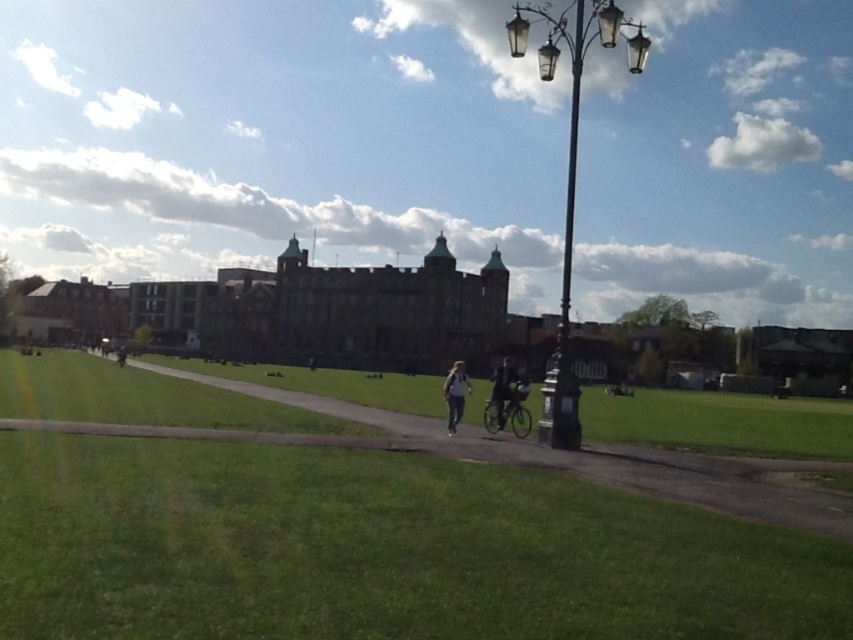
Question: Is green grass at center thinner than dark blue fabric jacket at center?

Choices:
 (A) yes
 (B) no

Answer: (B)

Question: Which object is the closest to the white fabric jacket at center?

Choices:
 (A) dark blue fabric jacket at center
 (B) matte brown building at center
 (C) polished metal lamp post at center-right

Answer: (A)

Question: Can you confirm if green grass at center is positioned below dark gray jacket at center?

Choices:
 (A) yes
 (B) no

Answer: (B)

Question: Among these points, which one is farthest from the camera?

Choices:
 (A) (505, 385)
 (B) (711, 472)

Answer: (A)

Question: Among these points, which one is nearest to the camera?

Choices:
 (A) (119, 364)
 (B) (509, 394)
 (C) (579, 435)

Answer: (C)

Question: Does matte brown building at center appear over white fabric jacket at center?

Choices:
 (A) yes
 (B) no

Answer: (A)